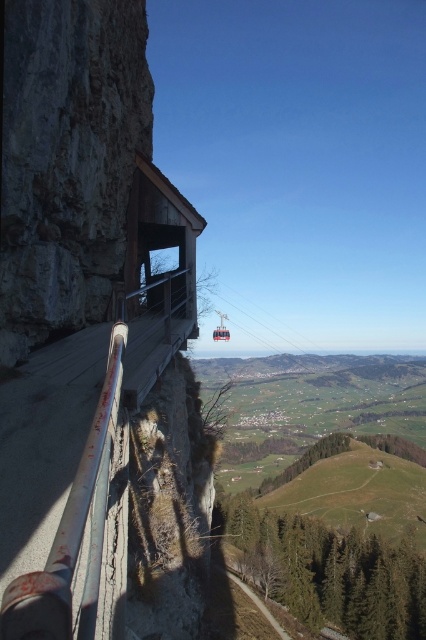
Between silver metallic rail at left and metallic cable car at center, which one is positioned higher?

Positioned higher is silver metallic rail at left.

Is silver metallic rail at left below metallic cable car at center?

No, silver metallic rail at left is not below metallic cable car at center.

Between point (89, 579) and point (221, 336), which one is positioned behind?

Positioned behind is point (221, 336).

At what (x,y) coordinates should I click in order to perform the action: click on silver metallic rail at left. Please return your answer as a coordinate pair (x, y). Looking at the image, I should click on (72, 531).